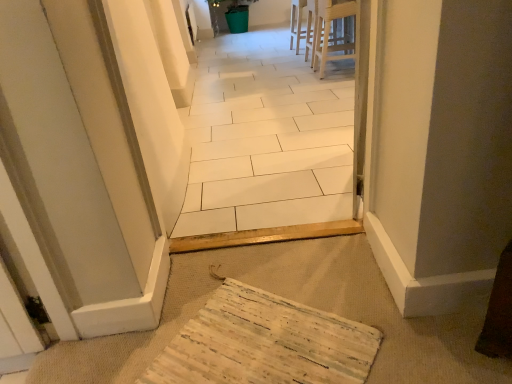
Question: Is light wood stool at upper center positioned beyond the bounds of white tile floor at center?

Choices:
 (A) yes
 (B) no

Answer: (A)

Question: Considering the relative sizes of light wood stool at upper center and white tile floor at center in the image provided, is light wood stool at upper center wider than white tile floor at center?

Choices:
 (A) yes
 (B) no

Answer: (A)

Question: Is light wood stool at upper center taller than white tile floor at center?

Choices:
 (A) no
 (B) yes

Answer: (A)

Question: Is light wood stool at upper center at the left side of white tile floor at center?

Choices:
 (A) yes
 (B) no

Answer: (B)

Question: Is white tile floor at center completely or partially inside light wood stool at upper center?

Choices:
 (A) yes
 (B) no

Answer: (B)

Question: Does light wood stool at upper center have a lesser width compared to white tile floor at center?

Choices:
 (A) yes
 (B) no

Answer: (B)

Question: Can we say light wood stool at upper center lies outside wooden textured mat at lower center?

Choices:
 (A) yes
 (B) no

Answer: (A)

Question: From the image's perspective, is light wood stool at upper center on wooden textured mat at lower center?

Choices:
 (A) yes
 (B) no

Answer: (A)

Question: From the image's perspective, does light wood stool at upper center appear lower than wooden textured mat at lower center?

Choices:
 (A) no
 (B) yes

Answer: (A)

Question: From a real-world perspective, is light wood stool at upper center below wooden textured mat at lower center?

Choices:
 (A) yes
 (B) no

Answer: (B)

Question: Is light wood stool at upper center not near wooden textured mat at lower center?

Choices:
 (A) no
 (B) yes

Answer: (B)

Question: Considering the relative sizes of light wood stool at upper center and wooden textured mat at lower center in the image provided, is light wood stool at upper center smaller than wooden textured mat at lower center?

Choices:
 (A) yes
 (B) no

Answer: (B)

Question: Can light wood stool at upper center be found inside white wood chair at upper center?

Choices:
 (A) no
 (B) yes

Answer: (A)